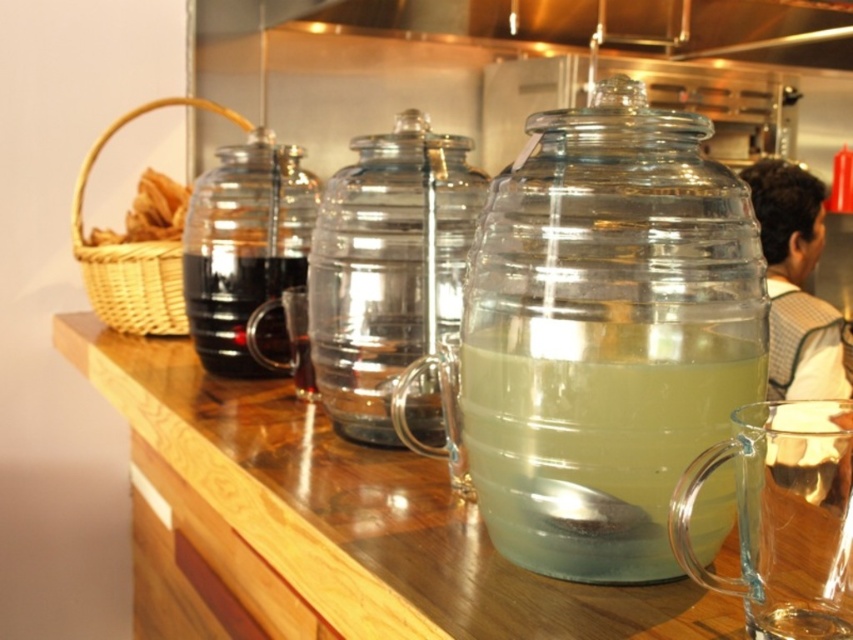
Question: Among these points, which one is nearest to the camera?

Choices:
 (A) (343, 410)
 (B) (735, 534)

Answer: (B)

Question: Which of these objects is positioned farthest from the transparent glass carafe at center?

Choices:
 (A) transparent glass counter top at center
 (B) brown woven basket at left
 (C) translucent glass jug at center

Answer: (C)

Question: Can you confirm if translucent glass jug at center is thinner than brown woven basket at left?

Choices:
 (A) no
 (B) yes

Answer: (B)

Question: Is clear glass jar at center below transparent glass carafe at center?

Choices:
 (A) yes
 (B) no

Answer: (A)

Question: Can you confirm if clear glass jug at center is positioned to the left of transparent glass carafe at center?

Choices:
 (A) yes
 (B) no

Answer: (B)

Question: Which object is positioned closest to the clear glass jug at center?

Choices:
 (A) translucent glass jug at center
 (B) clear glass jar at center

Answer: (B)